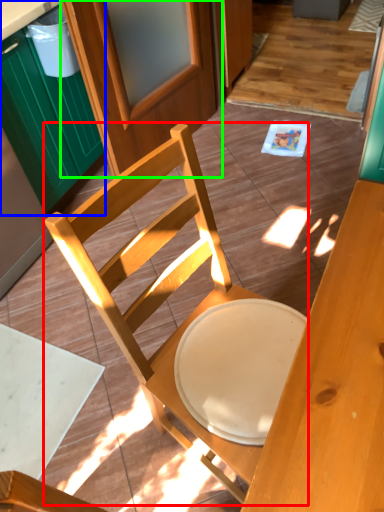
Question: Based on their relative distances, which object is farther from chair (highlighted by a red box)? Choose from cabinetry (highlighted by a blue box) and screen door (highlighted by a green box).

Choices:
 (A) cabinetry
 (B) screen door

Answer: (B)